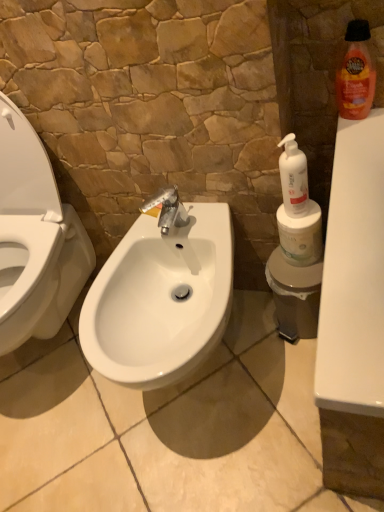
The height and width of the screenshot is (512, 384). Find the location of `free spot in front of white glossy sink at center`. free spot in front of white glossy sink at center is located at coordinates (241, 459).